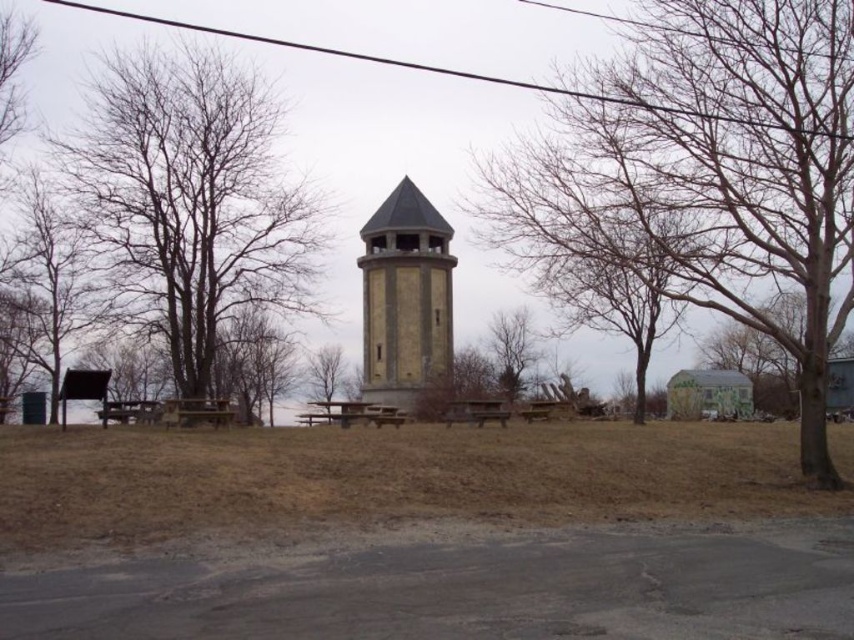
Question: Can you confirm if bare wood tree at center is wider than bare wood picnic table at center?

Choices:
 (A) yes
 (B) no

Answer: (A)

Question: Among these objects, which one is farthest from the camera?

Choices:
 (A) bare wood picnic table at left
 (B) brown rough bark tree at center
 (C) bare wood picnic table at center
 (D) brown dry grass at center

Answer: (B)

Question: Among these points, which one is farthest from the camera?

Choices:
 (A) pyautogui.click(x=509, y=332)
 (B) pyautogui.click(x=787, y=500)
 (C) pyautogui.click(x=756, y=140)
 (D) pyautogui.click(x=151, y=292)

Answer: (A)

Question: Which point is farther to the camera?

Choices:
 (A) [45, 253]
 (B) [309, 449]
 (C) [115, 10]
 (D) [516, 394]

Answer: (D)

Question: In this image, where is bare wood tree at left located relative to yellowish stone bell tower at center?

Choices:
 (A) left
 (B) right

Answer: (A)

Question: Is bare wood tree at center below bare wood tree at left?

Choices:
 (A) no
 (B) yes

Answer: (B)